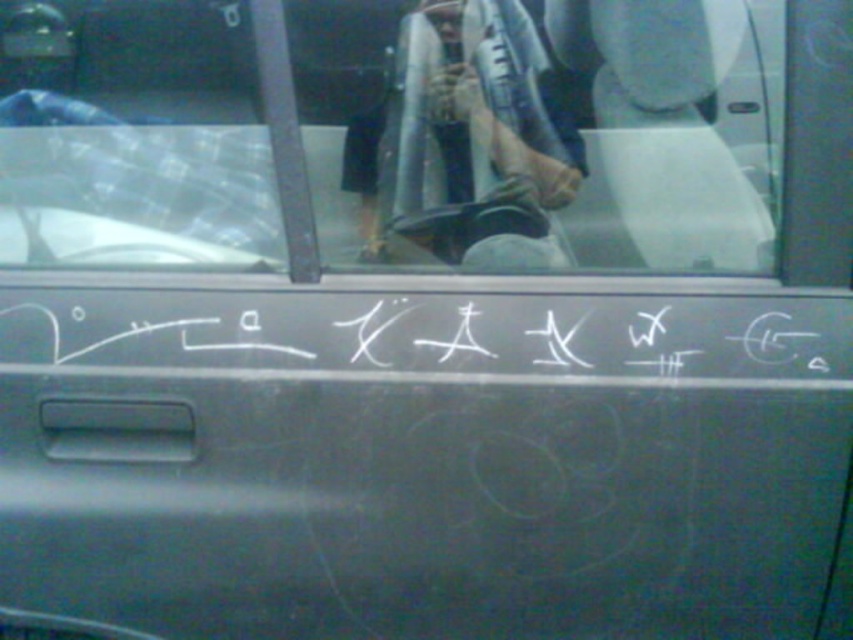
You are a pedestrian standing on the sidewalk next to a car. You notice the transparent glass windshield at upper center and the white chalk writing at center. Which object is higher up on the car?

The transparent glass windshield at upper center is higher up on the car than the white chalk writing at center.

You are a passenger in the car and want to reach a point inside the vehicle. The points you can choose are point (x=735, y=176) and point (x=506, y=317). Which point is closer to you?

Point (x=506, y=317) is closer to you because it is in front of point (x=735, y=176).

You are a pedestrian standing on the sidewalk next to a car. You notice the transparent glass windshield at upper center and the white chalk writing at center. Which object is positioned to the left from your viewpoint?

The transparent glass windshield at upper center is to the left of the white chalk writing at center.